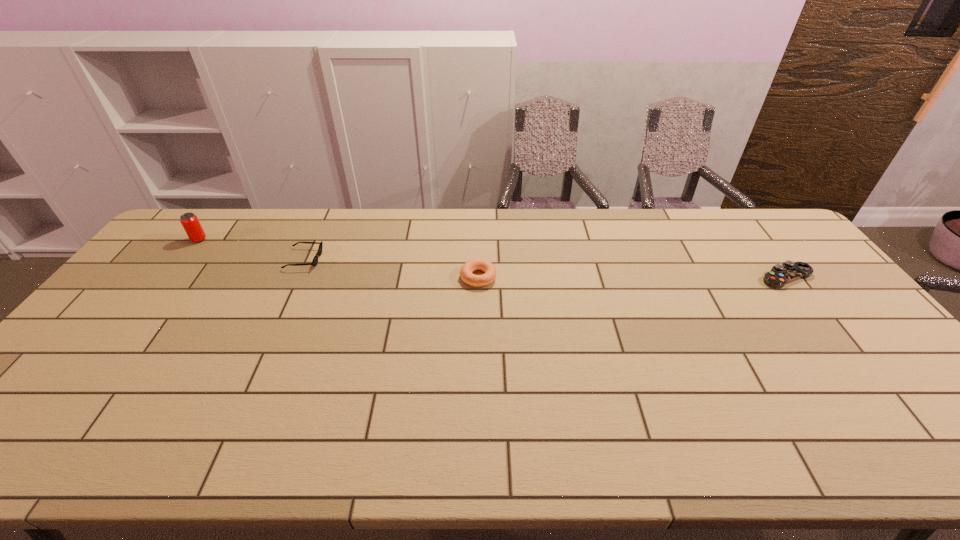
Where is `vacant space that is in between the second object from left to right and the bagel`? vacant space that is in between the second object from left to right and the bagel is located at coordinates (391, 268).

The height and width of the screenshot is (540, 960). In order to click on empty space that is in between the can and the second object from left to right in this screenshot , I will do `click(252, 249)`.

Locate an element on the screen. The width and height of the screenshot is (960, 540). free space between the bagel and the rightmost object is located at coordinates (633, 278).

Identify the location of vacant area that lies between the rightmost object and the second object from right to left. (633, 278).

You are a GUI agent. You are given a task and a screenshot of the screen. Output one action in this format:
    pyautogui.click(x=<x>, y=<y>)
    Task: Click on the vacant area between the third object from right to left and the rightmost object
    The width and height of the screenshot is (960, 540).
    Given the screenshot: What is the action you would take?
    pyautogui.click(x=545, y=268)

Where is `vacant area between the bagel and the second object from left to right`? The height and width of the screenshot is (540, 960). vacant area between the bagel and the second object from left to right is located at coordinates (391, 268).

Where is `free space between the sunglasses and the second object from right to left`? The height and width of the screenshot is (540, 960). free space between the sunglasses and the second object from right to left is located at coordinates (391, 268).

The image size is (960, 540). In order to click on empty space that is in between the control and the shortest object in this screenshot , I will do `click(545, 268)`.

Locate an element on the screen. This screenshot has width=960, height=540. free space between the control and the tallest object is located at coordinates (492, 259).

You are a GUI agent. You are given a task and a screenshot of the screen. Output one action in this format:
    pyautogui.click(x=<x>, y=<y>)
    Task: Click on the free spot between the bagel and the farthest object
    
    Given the screenshot: What is the action you would take?
    pyautogui.click(x=339, y=258)